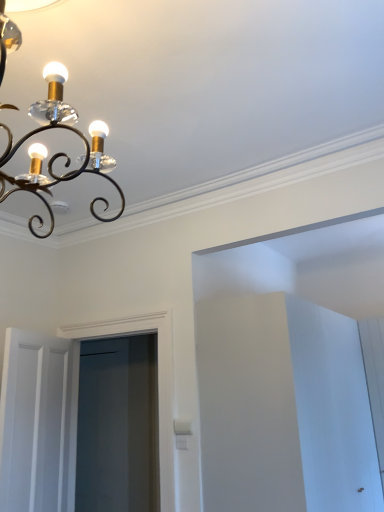
The width and height of the screenshot is (384, 512). What do you see at coordinates (118, 426) in the screenshot?
I see `clear glass screen door at center` at bounding box center [118, 426].

Find the location of a particular element. The image size is (384, 512). white wooden door at lower left is located at coordinates (34, 422).

From a real-world perspective, is matte black chandelier at upper left positioned above or below white wooden door at lower left?

From a real-world perspective, matte black chandelier at upper left is physically above white wooden door at lower left.

Is point (90, 169) positioned before point (63, 341)?

Yes, point (90, 169) is in front of point (63, 341).

Would you consider matte black chandelier at upper left to be distant from white wooden door at lower left?

matte black chandelier at upper left is far away from white wooden door at lower left.

Is matte black chandelier at upper left closer to camera compared to white wooden door at lower left?

Yes.

Does clear glass screen door at center touch matte black chandelier at upper left?

No.

How different are the orientations of clear glass screen door at center and matte black chandelier at upper left in degrees?

179 degrees separate the facing orientations of clear glass screen door at center and matte black chandelier at upper left.

From the picture: From the image's perspective, who appears lower, clear glass screen door at center or matte black chandelier at upper left?

clear glass screen door at center.

Can matte black chandelier at upper left be found inside clear glass screen door at center?

Actually, matte black chandelier at upper left is outside clear glass screen door at center.

Based on their positions, is white wooden door at lower left located to the left or right of clear glass screen door at center?

Clearly, white wooden door at lower left is on the left of clear glass screen door at center in the image.

Who is shorter, white wooden door at lower left or clear glass screen door at center?

With less height is white wooden door at lower left.

From the picture: Is white wooden door at lower left situated inside clear glass screen door at center or outside?

white wooden door at lower left lies outside clear glass screen door at center.

How distant is white wooden door at lower left from clear glass screen door at center?

A distance of 3.55 feet exists between white wooden door at lower left and clear glass screen door at center.

You are a GUI agent. You are given a task and a screenshot of the screen. Output one action in this format:
    pyautogui.click(x=<x>, y=<y>)
    Task: Click on the screen door above the white wooden door at lower left (from the image's perspective)
    The height and width of the screenshot is (512, 384).
    Given the screenshot: What is the action you would take?
    pyautogui.click(x=118, y=426)

Is clear glass screen door at center inside the boundaries of white wooden door at lower left, or outside?

clear glass screen door at center cannot be found inside white wooden door at lower left.

Between clear glass screen door at center and white wooden door at lower left, which one has larger width?

Wider between the two is clear glass screen door at center.

From a real-world perspective, is clear glass screen door at center positioned above or below white wooden door at lower left?

Clearly, from a real-world perspective, clear glass screen door at center is above white wooden door at lower left.

Locate an element on the screen. The width and height of the screenshot is (384, 512). door below the matte black chandelier at upper left (from the image's perspective) is located at coordinates (34, 422).

From the image's perspective, is white wooden door at lower left above or below matte black chandelier at upper left?

white wooden door at lower left is situated lower than matte black chandelier at upper left in the image.

Is point (65, 439) closer to camera compared to point (71, 177)?

No, (65, 439) is behind (71, 177).

Is white wooden door at lower left thinner than matte black chandelier at upper left?

Correct, the width of white wooden door at lower left is less than that of matte black chandelier at upper left.

Does matte black chandelier at upper left turn towards clear glass screen door at center?

No, matte black chandelier at upper left is not aimed at clear glass screen door at center.

Considering the sizes of matte black chandelier at upper left and clear glass screen door at center in the image, is matte black chandelier at upper left taller or shorter than clear glass screen door at center?

Clearly, matte black chandelier at upper left is shorter compared to clear glass screen door at center.

From a real-world perspective, relative to clear glass screen door at center, is matte black chandelier at upper left vertically above or below?

matte black chandelier at upper left is above clear glass screen door at center.

Where is `door on the left of matte black chandelier at upper left`? The image size is (384, 512). door on the left of matte black chandelier at upper left is located at coordinates (34, 422).

Locate an element on the screen. lamp in front of the clear glass screen door at center is located at coordinates (58, 152).

Which object lies further to the anchor point matte black chandelier at upper left, clear glass screen door at center or white wooden door at lower left?

Among the two, clear glass screen door at center is located further to matte black chandelier at upper left.

Considering their positions, is white wooden door at lower left positioned closer to clear glass screen door at center than matte black chandelier at upper left?

Based on the image, white wooden door at lower left appears to be nearer to clear glass screen door at center.

From the image, which object appears to be nearer to white wooden door at lower left, matte black chandelier at upper left or clear glass screen door at center?

clear glass screen door at center is closer to white wooden door at lower left.

Which object lies further to the anchor point white wooden door at lower left, clear glass screen door at center or matte black chandelier at upper left?

matte black chandelier at upper left.

Looking at this image, considering their positions, is matte black chandelier at upper left positioned further to clear glass screen door at center than white wooden door at lower left?

matte black chandelier at upper left lies further to clear glass screen door at center than the other object.

Based on their spatial positions, is white wooden door at lower left or clear glass screen door at center further from matte black chandelier at upper left?

clear glass screen door at center is positioned further to the anchor matte black chandelier at upper left.

Locate an element on the screen. door positioned between matte black chandelier at upper left and clear glass screen door at center from near to far is located at coordinates coord(34,422).